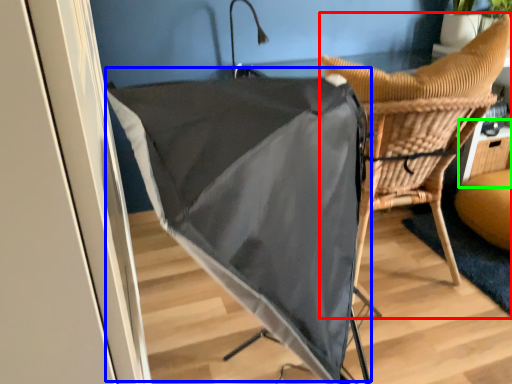
Question: Considering the real-world distances, which object is closest to chair (highlighted by a red box)? umbrella (highlighted by a blue box) or table (highlighted by a green box).

Choices:
 (A) umbrella
 (B) table

Answer: (A)